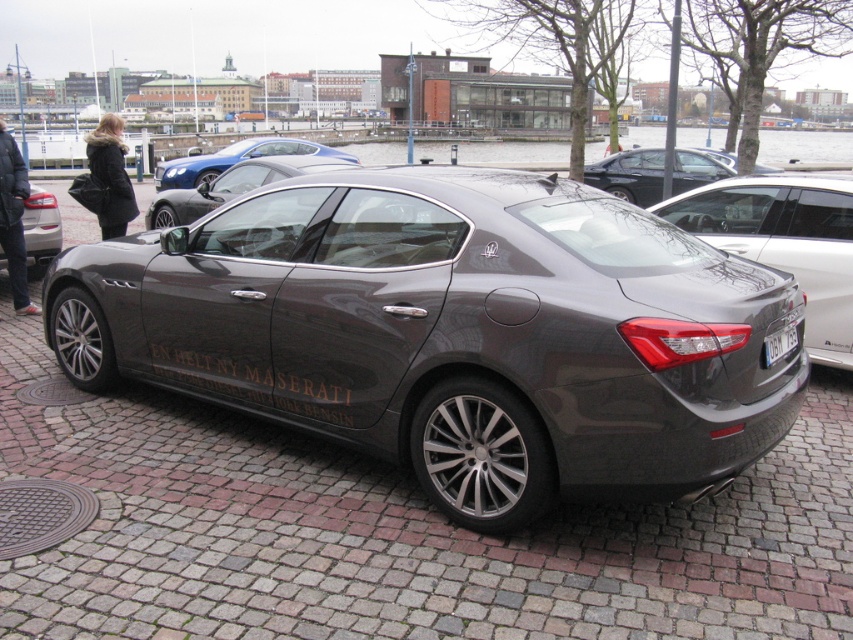
Question: Can you confirm if satin metallic car at center is bigger than satin dark gray car at center?

Choices:
 (A) no
 (B) yes

Answer: (B)

Question: In this image, where is satin metallic car at center located relative to matte black car at left?

Choices:
 (A) right
 (B) left

Answer: (A)

Question: Among these points, which one is farthest from the camera?

Choices:
 (A) tap(543, 339)
 (B) tap(171, 168)
 (C) tap(770, 355)
 (D) tap(221, 180)

Answer: (B)

Question: Which point is farther from the camera taking this photo?

Choices:
 (A) (811, 273)
 (B) (402, 225)
 (C) (285, 161)

Answer: (C)

Question: Is satin metallic car at center positioned behind satin blue car at center?

Choices:
 (A) yes
 (B) no

Answer: (B)

Question: Which object appears closest to the camera in this image?

Choices:
 (A) black plastic license plate at center
 (B) satin metallic car at center
 (C) satin blue car at center

Answer: (B)